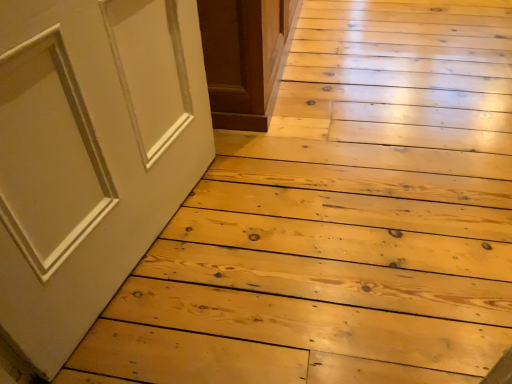
The height and width of the screenshot is (384, 512). Identify the location of white painted wood door at left. (91, 155).

Describe the element at coordinates (91, 155) in the screenshot. I see `white painted wood door at left` at that location.

Identify the location of white painted wood door at left. This screenshot has width=512, height=384. (91, 155).